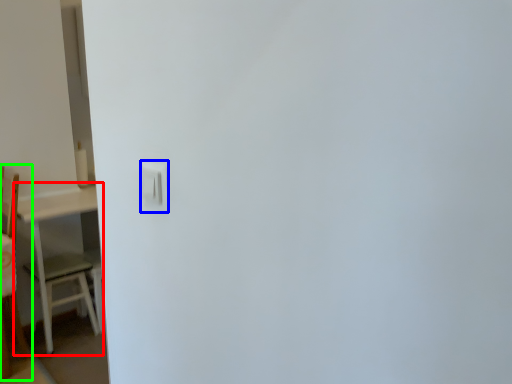
Question: Considering the real-world distances, which object is farthest from table (highlighted by a red box)? light switch (highlighted by a blue box) or furniture (highlighted by a green box)?

Choices:
 (A) light switch
 (B) furniture

Answer: (A)